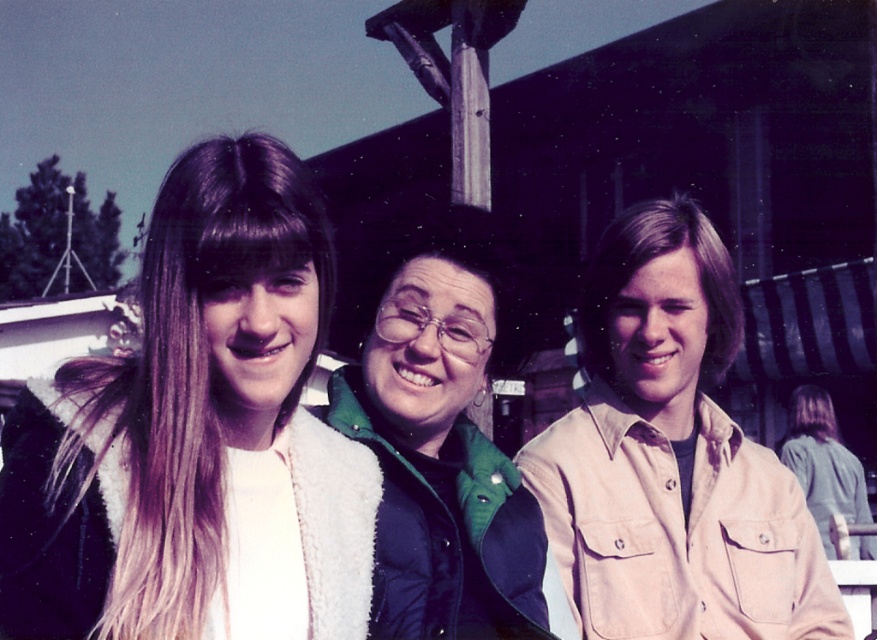
This screenshot has width=877, height=640. Find the location of `white fleece jacket at left`. white fleece jacket at left is located at coordinates (189, 420).

Find the location of a particular element. This screenshot has width=877, height=640. white fleece jacket at left is located at coordinates (189, 420).

Does beige cotton shirt at center have a smaller size compared to green fuzzy vest at center?

No.

Is point (712, 234) farther from viewer compared to point (447, 403)?

Yes, it is.

Find the location of `beige cotton shirt at center`. beige cotton shirt at center is located at coordinates (672, 458).

You are a GUI agent. You are given a task and a screenshot of the screen. Output one action in this format:
    pyautogui.click(x=<x>, y=<y>)
    Task: Click on the white fleece jacket at left
    
    Given the screenshot: What is the action you would take?
    pyautogui.click(x=189, y=420)